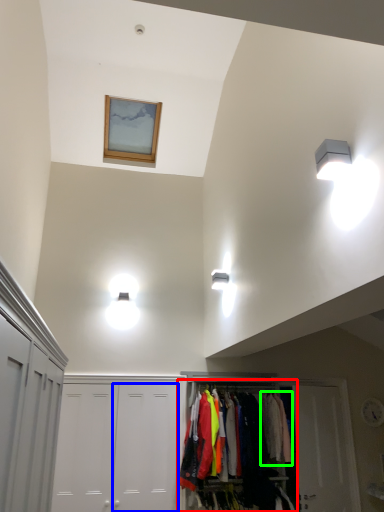
Question: Based on their relative distances, which object is nearer to dresser (highlighted by a red box)? Choose from door (highlighted by a blue box) and clothing (highlighted by a green box).

Choices:
 (A) door
 (B) clothing

Answer: (B)